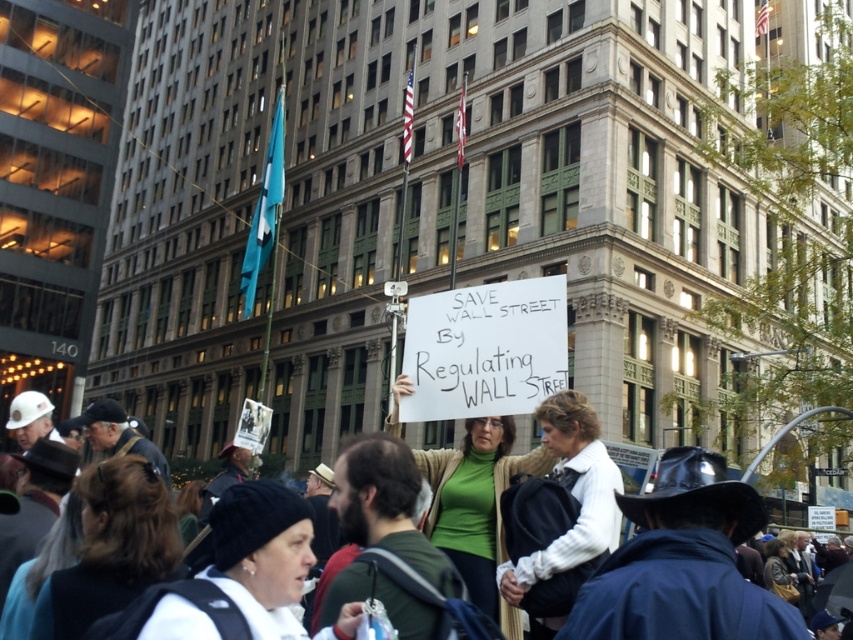
Question: Can you confirm if white fleece jacket at lower left is thinner than white matte jacket at center?

Choices:
 (A) no
 (B) yes

Answer: (A)

Question: Which point appears closest to the camera in this image?

Choices:
 (A) (112, 624)
 (B) (434, 468)
 (C) (595, 449)

Answer: (A)

Question: Is white fleece jacket at lower left thinner than dark brown hair at lower left?

Choices:
 (A) yes
 (B) no

Answer: (B)

Question: Based on their relative distances, which object is nearer to the green jersey at center?

Choices:
 (A) white fleece jacket at lower left
 (B) dark brown hair at lower left
 (C) white matte jacket at center
 (D) green sweater at center

Answer: (C)

Question: Which object is the farthest from the green jersey at center?

Choices:
 (A) white fleece jacket at lower left
 (B) dark brown hair at lower left
 (C) green sweater at center

Answer: (C)

Question: Can you confirm if white fleece jacket at lower left is smaller than green jersey at center?

Choices:
 (A) yes
 (B) no

Answer: (A)